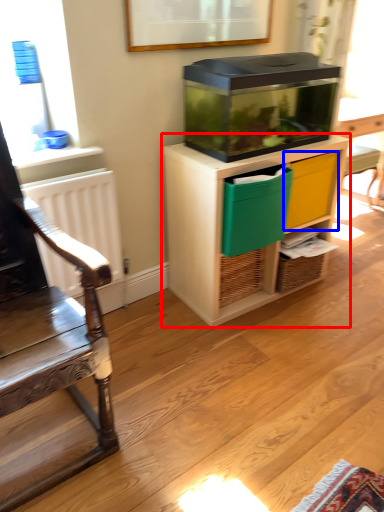
Question: Which point is further to the camera, cabinetry (highlighted by a red box) or drawer (highlighted by a blue box)?

Choices:
 (A) cabinetry
 (B) drawer

Answer: (B)